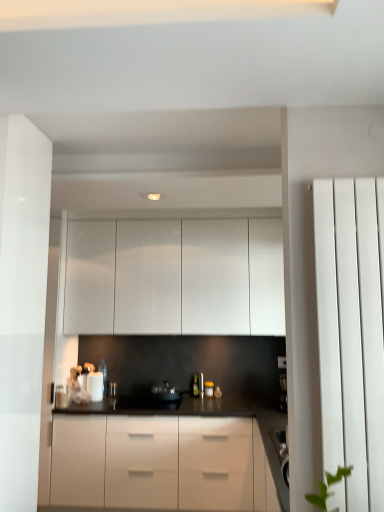
Question: Is the position of white smooth radiator at right less distant than that of white glossy cabinets at upper center?

Choices:
 (A) no
 (B) yes

Answer: (B)

Question: Is white smooth radiator at right facing away from white glossy cabinets at upper center?

Choices:
 (A) yes
 (B) no

Answer: (A)

Question: Is white smooth radiator at right not close to white glossy cabinets at upper center?

Choices:
 (A) no
 (B) yes

Answer: (B)

Question: Does white smooth radiator at right appear on the right side of white glossy cabinets at upper center?

Choices:
 (A) no
 (B) yes

Answer: (B)

Question: From the image's perspective, would you say white smooth radiator at right is shown under white glossy cabinets at upper center?

Choices:
 (A) no
 (B) yes

Answer: (B)

Question: From a real-world perspective, is white glossy cabinets at upper center above or below black matte countertop at center?

Choices:
 (A) below
 (B) above

Answer: (B)

Question: Considering their positions, is white glossy cabinets at upper center located in front of or behind black matte countertop at center?

Choices:
 (A) front
 (B) behind

Answer: (B)

Question: Is white glossy cabinets at upper center wider or thinner than black matte countertop at center?

Choices:
 (A) thin
 (B) wide

Answer: (A)

Question: Would you say white glossy cabinets at upper center is to the left or to the right of black matte countertop at center in the picture?

Choices:
 (A) right
 (B) left

Answer: (A)

Question: Considering the positions of black matte countertop at center and black plastic coffee machine at right in the image, is black matte countertop at center wider or thinner than black plastic coffee machine at right?

Choices:
 (A) wide
 (B) thin

Answer: (A)

Question: From a real-world perspective, is black matte countertop at center physically located above or below black plastic coffee machine at right?

Choices:
 (A) below
 (B) above

Answer: (A)

Question: From the image's perspective, is black matte countertop at center positioned above or below black plastic coffee machine at right?

Choices:
 (A) below
 (B) above

Answer: (A)

Question: Is black matte countertop at center taller or shorter than black plastic coffee machine at right?

Choices:
 (A) short
 (B) tall

Answer: (B)

Question: Visually, is matte silver faucet at center positioned to the left or to the right of black matte countertop at center?

Choices:
 (A) left
 (B) right

Answer: (B)

Question: Considering their positions, is matte silver faucet at center located in front of or behind black matte countertop at center?

Choices:
 (A) front
 (B) behind

Answer: (B)